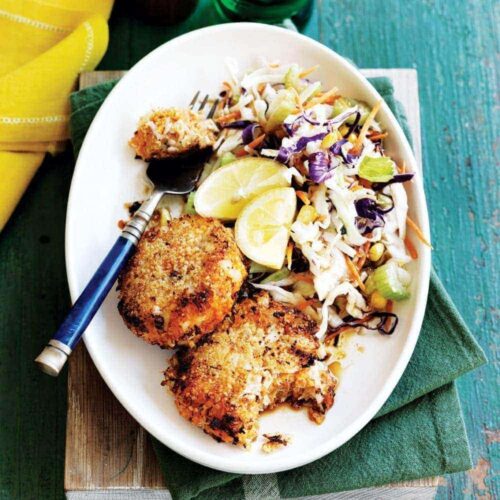
Locate an element on the screen. This screenshot has height=500, width=500. white plate is located at coordinates (208, 55).